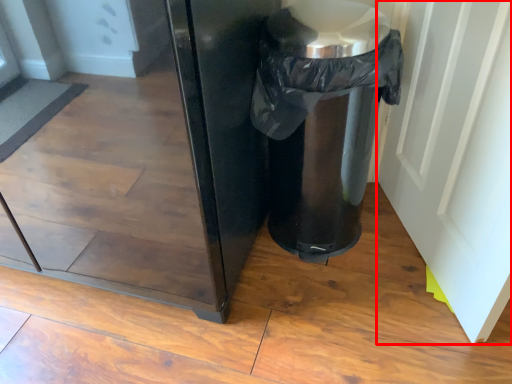
Question: From the image's perspective, what is the correct spatial positioning of screen door (annotated by the red box) in reference to waste container?

Choices:
 (A) above
 (B) below

Answer: (B)